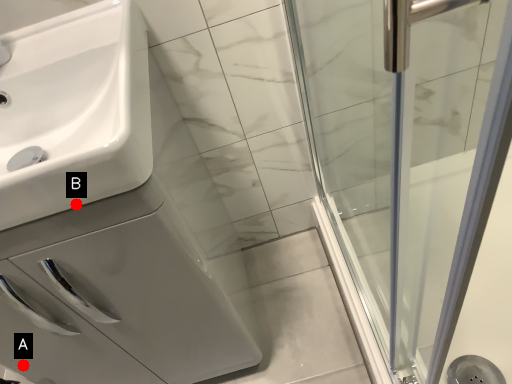
Question: Two points are circled on the image, labeled by A and B beside each circle. Which point is farther to the camera?

Choices:
 (A) A is further
 (B) B is further

Answer: (A)